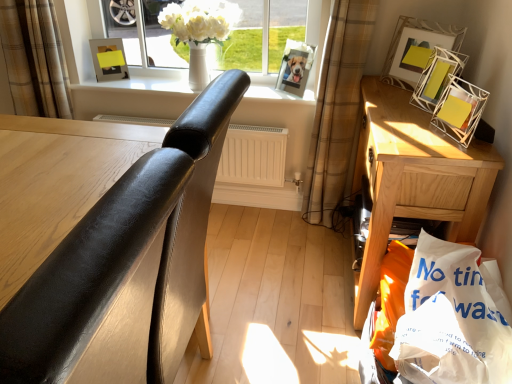
Question: In terms of width, does yellow matte picture frame at upper left, the first picture frame positioned from the left, look wider or thinner when compared to wooden nightstand at right?

Choices:
 (A) wide
 (B) thin

Answer: (B)

Question: From the image's perspective, relative to wooden nightstand at right, is yellow matte picture frame at upper left, the first picture frame positioned from the left, above or below?

Choices:
 (A) below
 (B) above

Answer: (B)

Question: Which object is positioned farthest from the black leather chair at left?

Choices:
 (A) metallic silver photo frame at upper center, the 3th picture frame viewed from the right
 (B) white paper shopping bag at lower right
 (C) plaid fabric curtain at upper left, which appears as the 1th curtain when viewed from the left
 (D) plaid fabric curtain at center, the second curtain when ordered from left to right
 (E) yellow matte picture frame at upper left, acting as the 4th picture frame starting from the right

Answer: (E)

Question: Which of these objects is positioned closest to the plaid fabric curtain at center, the second curtain when ordered from left to right?

Choices:
 (A) plaid fabric curtain at upper left, which appears as the 1th curtain when viewed from the left
 (B) yellow matte picture frame at upper left, acting as the 4th picture frame starting from the right
 (C) metallic silver picture frame at upper right, which is counted as the 3th picture frame, starting from the left
 (D) black leather chair at left
 (E) white glossy vase at upper center

Answer: (C)